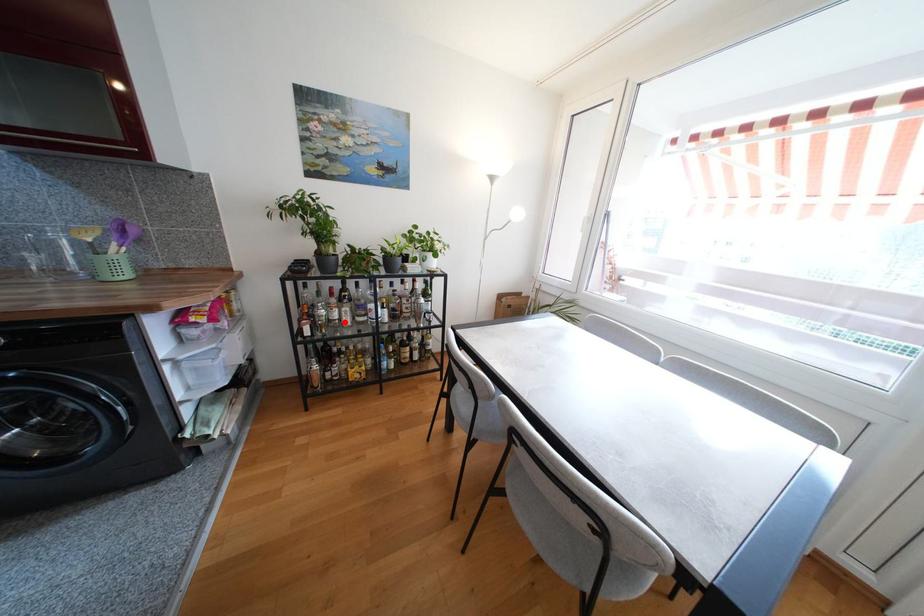
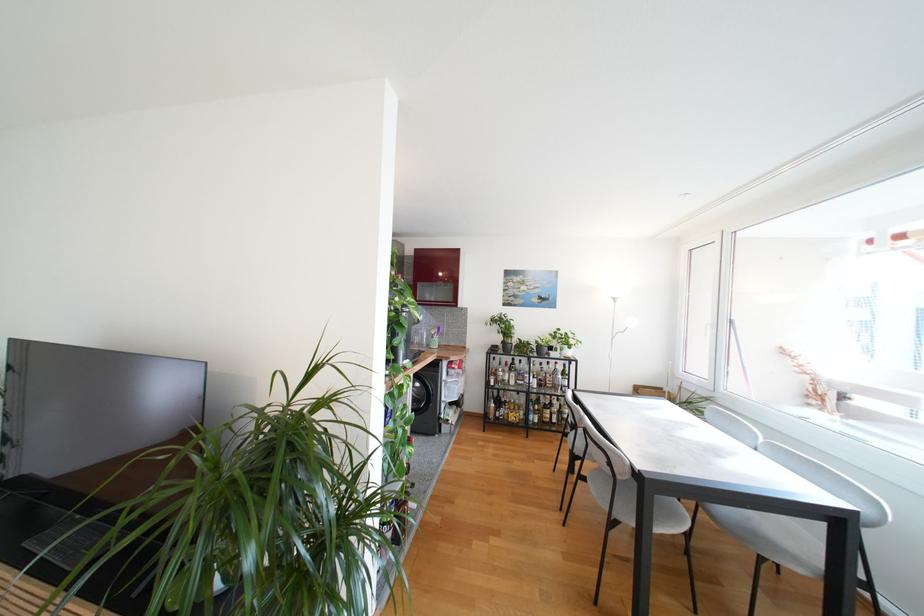
Question: I am providing you with two images of the same scene from different viewpoints. Given a red point in image1, look at the same physical point in image2. Is it:

Choices:
 (A) Closer to the viewpoint
 (B) Farther from the viewpoint

Answer: (B)